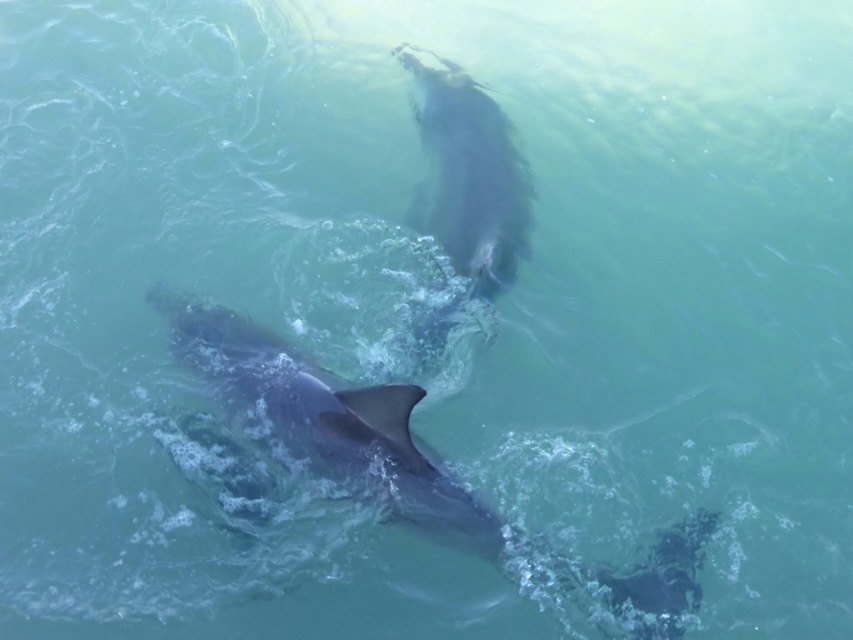
Question: Among these points, which one is nearest to the camera?

Choices:
 (A) coord(245,355)
 (B) coord(466,259)

Answer: (A)

Question: Does gray smooth dolphin at center appear under gray matte whale at upper center?

Choices:
 (A) yes
 (B) no

Answer: (A)

Question: Is gray smooth dolphin at center bigger than gray matte whale at upper center?

Choices:
 (A) no
 (B) yes

Answer: (B)

Question: Is gray smooth dolphin at center positioned in front of gray matte whale at upper center?

Choices:
 (A) no
 (B) yes

Answer: (B)